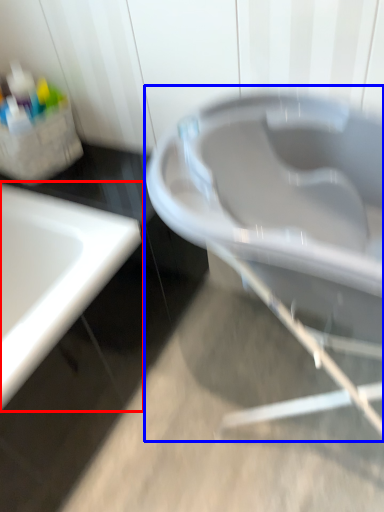
Question: Which of the following is the closest to the observer, sink (highlighted by a red box) or bath (highlighted by a blue box)?

Choices:
 (A) sink
 (B) bath

Answer: (B)